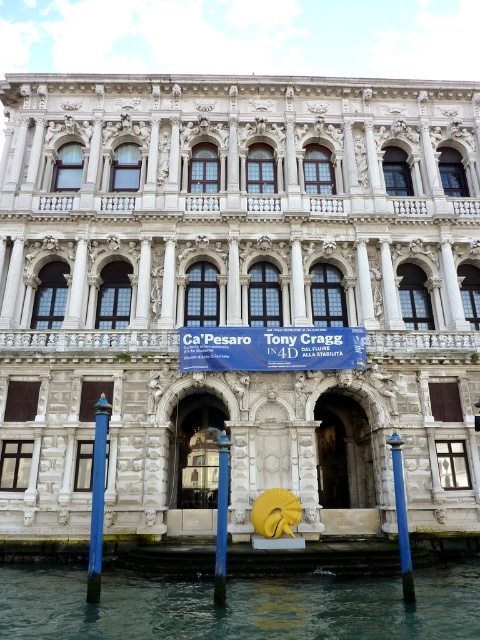
Based on the photo, you are standing in front of Ca Pesaro in Venice and see the blue painted wood post at lower left and the blue glossy pole at center. Which one is higher up on the building?

The blue painted wood post at lower left is above the blue glossy pole at center, so it is higher up on the building.